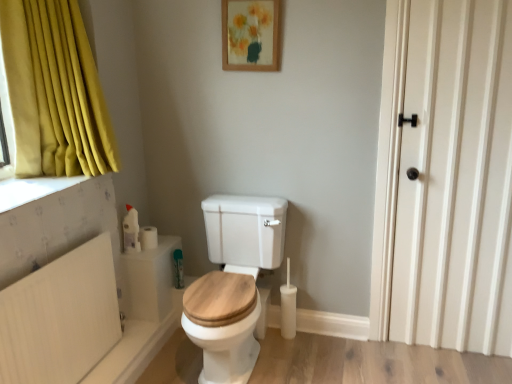
What do you see at coordinates (60, 317) in the screenshot? I see `white plastic radiator at lower left` at bounding box center [60, 317].

Identify the location of wooden toilet seat at center. The image size is (512, 384). coord(233,283).

What do you see at coordinates (148, 237) in the screenshot? I see `white matte toilet paper at lower left, the second toilet paper viewed from the front` at bounding box center [148, 237].

In order to click on white matte toilet paper at lower left, positioned as the first toilet paper in front-to-back order in this screenshot , I will do `click(137, 233)`.

What is the approximate width of wooden picture frame at upper center?

2.05 inches.

Find the location of a particular element. This screenshot has height=384, width=512. white plastic radiator at lower left is located at coordinates (60, 317).

From the image's perspective, which one is positioned lower, green plastic toothbrush at lower center or wooden picture frame at upper center?

From the image's view, green plastic toothbrush at lower center is below.

Is green plastic toothbrush at lower center completely or partially outside of wooden picture frame at upper center?

Yes, green plastic toothbrush at lower center is not within wooden picture frame at upper center.

From a real-world perspective, is green plastic toothbrush at lower center located beneath wooden picture frame at upper center?

Yes, from a real-world perspective, green plastic toothbrush at lower center is beneath wooden picture frame at upper center.

Which object is closer to the camera, white matte toilet paper at lower left, the second toilet paper viewed from the front, or wooden toilet seat at center?

wooden toilet seat at center is closer to the camera.

Is white matte toilet paper at lower left, the second toilet paper viewed from the front, smaller than wooden toilet seat at center?

Correct, white matte toilet paper at lower left, the second toilet paper viewed from the front, occupies less space than wooden toilet seat at center.

Does white matte toilet paper at lower left, the first toilet paper viewed from the back, touch wooden toilet seat at center?

There is a gap between white matte toilet paper at lower left, the first toilet paper viewed from the back, and wooden toilet seat at center.

Who is bigger, wooden picture frame at upper center or white plastic radiator at lower left?

white plastic radiator at lower left is bigger.

Could you tell me if wooden picture frame at upper center is turned towards white plastic radiator at lower left?

No.

Where is `picture frame above the white plastic radiator at lower left (from a real-world perspective)`? picture frame above the white plastic radiator at lower left (from a real-world perspective) is located at coordinates (251, 35).

Does wooden picture frame at upper center appear on the left side of white plastic radiator at lower left?

Incorrect, wooden picture frame at upper center is not on the left side of white plastic radiator at lower left.

Is white matte toilet paper at lower left, positioned as the first toilet paper in front-to-back order, far away from wooden picture frame at upper center?

Absolutely, white matte toilet paper at lower left, positioned as the first toilet paper in front-to-back order, is distant from wooden picture frame at upper center.

Considering the sizes of objects white matte toilet paper at lower left, marked as the 2th toilet paper in a back-to-front arrangement, and wooden picture frame at upper center in the image provided, who is smaller, white matte toilet paper at lower left, marked as the 2th toilet paper in a back-to-front arrangement, or wooden picture frame at upper center?

With smaller size is white matte toilet paper at lower left, marked as the 2th toilet paper in a back-to-front arrangement.

Consider the image. Considering the relative sizes of white matte toilet paper at lower left, positioned as the first toilet paper in front-to-back order, and wooden picture frame at upper center in the image provided, is white matte toilet paper at lower left, positioned as the first toilet paper in front-to-back order, taller than wooden picture frame at upper center?

No, white matte toilet paper at lower left, positioned as the first toilet paper in front-to-back order, is not taller than wooden picture frame at upper center.

From the image's perspective, which is below, white matte toilet paper at lower left, positioned as the first toilet paper in front-to-back order, or wooden picture frame at upper center?

From the image's view, white matte toilet paper at lower left, positioned as the first toilet paper in front-to-back order, is below.

Considering the relative positions of wooden picture frame at upper center and wooden toilet seat at center in the image provided, is wooden picture frame at upper center to the left or to the right of wooden toilet seat at center?

From the image, it's evident that wooden picture frame at upper center is to the right of wooden toilet seat at center.

Where is `picture frame above the wooden toilet seat at center (from a real-world perspective)`? Image resolution: width=512 pixels, height=384 pixels. picture frame above the wooden toilet seat at center (from a real-world perspective) is located at coordinates (x=251, y=35).

Considering the positions of points (272, 69) and (256, 224), is point (272, 69) farther from camera compared to point (256, 224)?

No, it is in front of (256, 224).

From the image's perspective, who appears lower, wooden picture frame at upper center or wooden toilet seat at center?

wooden toilet seat at center appears lower in the image.

From a real-world perspective, which object stands above the other?

white matte door at right is physically above.

In terms of size, does white matte door at right appear bigger or smaller than white matte toilet paper at lower left, the second toilet paper viewed from the front?

In the image, white matte door at right appears to be larger than white matte toilet paper at lower left, the second toilet paper viewed from the front.

From the picture: Is white matte toilet paper at lower left, the first toilet paper viewed from the back, located within white matte door at right?

No.

Based on the photo, which is less distant, [471,65] or [155,229]?

Point [471,65] is closer to the camera than point [155,229].

From the image's perspective, relative to green plastic toothbrush at lower center, is white matte toilet paper at lower left, the second toilet paper viewed from the front, above or below?

Based on their image positions, white matte toilet paper at lower left, the second toilet paper viewed from the front, is located above green plastic toothbrush at lower center.

Considering their positions, is white matte toilet paper at lower left, the second toilet paper viewed from the front, located in front of or behind green plastic toothbrush at lower center?

white matte toilet paper at lower left, the second toilet paper viewed from the front, is in front of green plastic toothbrush at lower center.

How distant is white matte toilet paper at lower left, the second toilet paper viewed from the front, from green plastic toothbrush at lower center?

white matte toilet paper at lower left, the second toilet paper viewed from the front, and green plastic toothbrush at lower center are 7.63 inches apart.

What's the angular difference between white matte toilet paper at lower left, the first toilet paper viewed from the back, and green plastic toothbrush at lower center's facing directions?

There is a 89.7-degree angle between the facing directions of white matte toilet paper at lower left, the first toilet paper viewed from the back, and green plastic toothbrush at lower center.

Identify the location of picture frame on the right of the green plastic toothbrush at lower center. This screenshot has height=384, width=512. (x=251, y=35).

Locate an element on the screen. toilet paper that is the 2nd object located behind the wooden toilet seat at center is located at coordinates (148, 237).

Looking at this image, estimate the real-world distances between objects in this image. Which object is closer to green plastic toothbrush at lower center, white matte toilet paper at lower left, the first toilet paper viewed from the back, or white matte toilet paper at lower left, marked as the 2th toilet paper in a back-to-front arrangement?

white matte toilet paper at lower left, the first toilet paper viewed from the back, lies closer to green plastic toothbrush at lower center than the other object.

Based on their spatial positions, is green plastic toothbrush at lower center or white matte door at right further from white matte toilet paper at lower left, marked as the 2th toilet paper in a back-to-front arrangement?

white matte door at right is further to white matte toilet paper at lower left, marked as the 2th toilet paper in a back-to-front arrangement.

Based on their spatial positions, is white plastic radiator at lower left or wooden toilet seat at center further from wooden picture frame at upper center?

Based on the image, white plastic radiator at lower left appears to be further to wooden picture frame at upper center.

Considering their positions, is white matte door at right positioned further to wooden toilet seat at center than white matte toilet paper at lower left, positioned as the first toilet paper in front-to-back order?

The object further to wooden toilet seat at center is white matte door at right.

Looking at the image, which one is located closer to white matte door at right, green plastic toothbrush at lower center or white matte toilet paper at lower left, marked as the 2th toilet paper in a back-to-front arrangement?

The object closer to white matte door at right is green plastic toothbrush at lower center.

Which object lies further to the anchor point white matte door at right, wooden picture frame at upper center or wooden toilet seat at center?

wooden picture frame at upper center is positioned further to the anchor white matte door at right.

Looking at the image, which one is located closer to wooden toilet seat at center, white plastic radiator at lower left or white matte toilet paper at lower left, marked as the 2th toilet paper in a back-to-front arrangement?

Among the two, white matte toilet paper at lower left, marked as the 2th toilet paper in a back-to-front arrangement, is located nearer to wooden toilet seat at center.

Considering their positions, is white matte toilet paper at lower left, the second toilet paper viewed from the front, positioned closer to white matte door at right than wooden picture frame at upper center?

Among the two, wooden picture frame at upper center is located nearer to white matte door at right.

I want to click on toilet situated between white matte toilet paper at lower left, positioned as the first toilet paper in front-to-back order, and white matte door at right from left to right, so click(x=233, y=283).

Locate an element on the screen. Image resolution: width=512 pixels, height=384 pixels. toiletry between white plastic radiator at lower left and white matte door at right from left to right is located at coordinates (178, 269).

Identify the location of toiletry located between white matte toilet paper at lower left, the first toilet paper viewed from the back, and white matte door at right in the left-right direction. This screenshot has height=384, width=512. (178, 269).

Identify the location of toilet positioned between white plastic radiator at lower left and white matte toilet paper at lower left, positioned as the first toilet paper in front-to-back order, from near to far. This screenshot has width=512, height=384. (233, 283).